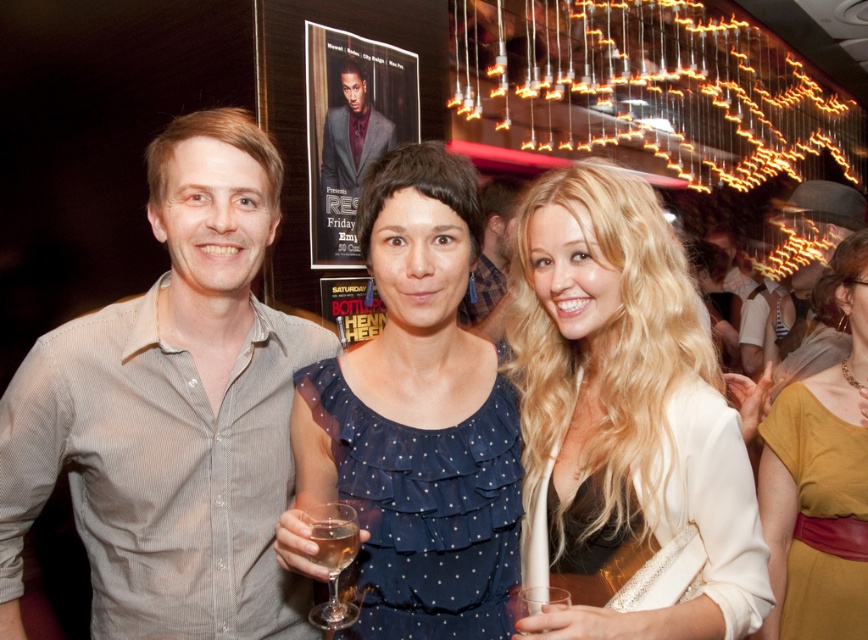
Is point (792, 316) positioned before point (327, 506)?

No.

Can you confirm if light brown leather hat at upper right is taller than clear glass wine at center?

Correct, light brown leather hat at upper right is much taller as clear glass wine at center.

Does point (793, 209) lie in front of point (337, 561)?

No, (793, 209) is behind (337, 561).

This screenshot has width=868, height=640. In order to click on light brown leather hat at upper right in this screenshot , I will do `click(824, 220)`.

Between matte gray shirt at center and clear glass wine glass at center, which one has less height?

clear glass wine glass at center is shorter.

This screenshot has height=640, width=868. Find the location of `matte gray shirt at center`. matte gray shirt at center is located at coordinates (492, 260).

Which is behind, point (481, 332) or point (342, 554)?

The point (481, 332) is behind.

Where is `matte gray shirt at center`? matte gray shirt at center is located at coordinates (492, 260).

In the scene shown: Does smooth gray suit at center have a larger size compared to clear glass wine at center?

Yes.

Which of these two, smooth gray suit at center or clear glass wine at center, stands shorter?

clear glass wine at center

Which is behind, point (346, 106) or point (347, 557)?

The point (346, 106) is more distant.

Identify the location of smooth gray suit at center. This screenshot has height=640, width=868. (352, 132).